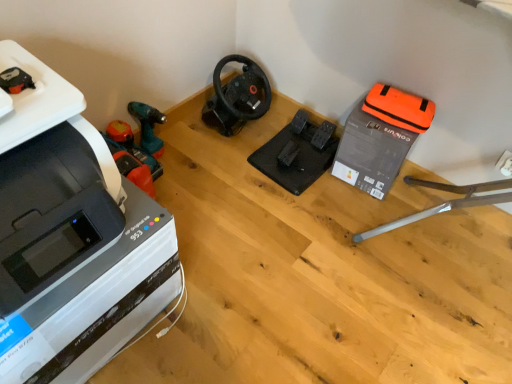
Question: Is point (106, 339) closer or farther from the camera than point (394, 157)?

Choices:
 (A) closer
 (B) farther

Answer: (A)

Question: From the image's perspective, is white plastic printer at left located above or below orange fabric bag at upper right, which appears as the second equipment when viewed from the left?

Choices:
 (A) above
 (B) below

Answer: (B)

Question: Estimate the real-world distances between objects in this image. Which object is closer to the orange plastic vacuum at left, which ranks as the 2th vacuum in right-to-left order?

Choices:
 (A) white plastic printer at left
 (B) black rubber pedals at center, which is the second equipment in right-to-left order
 (C) black matte steering wheel at center, the second vacuum positioned from the left
 (D) orange fabric bag at upper right, which appears as the second equipment when viewed from the left

Answer: (C)

Question: Which object is positioned closest to the black matte steering wheel at center, positioned as the first vacuum in right-to-left order?

Choices:
 (A) black rubber pedals at center, which is the second equipment in right-to-left order
 (B) orange fabric bag at upper right, which is the first equipment in right-to-left order
 (C) white plastic printer at left
 (D) orange plastic vacuum at left, which ranks as the 2th vacuum in right-to-left order

Answer: (A)